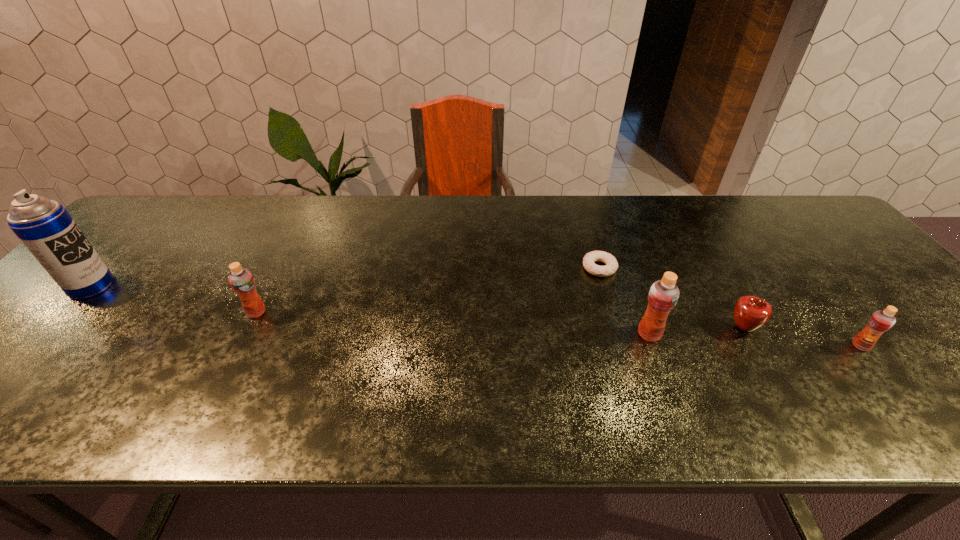
What are the coordinates of `vacant space at the right edge of the desktop` in the screenshot? It's located at (934, 350).

In the image, there is a desktop. At what (x,y) coordinates should I click in order to perform the action: click on vacant space at the far left corner. Please return your answer as a coordinate pair (x, y). Looking at the image, I should click on (182, 220).

The width and height of the screenshot is (960, 540). What are the coordinates of `vacant space at the far right corner` in the screenshot? It's located at (818, 235).

Find the location of a particular element. free area in between the tallest orange juice and the doughnut is located at coordinates (624, 301).

Where is `vacant area that lies between the leftmost object and the doughnut`? vacant area that lies between the leftmost object and the doughnut is located at coordinates (346, 277).

Image resolution: width=960 pixels, height=540 pixels. I want to click on free space between the second object from right to left and the rightmost orange juice, so click(802, 337).

Where is `empty space that is in between the fourth tallest object and the second shortest orange juice`? empty space that is in between the fourth tallest object and the second shortest orange juice is located at coordinates (559, 329).

Identify the location of free spot between the fifth object from right to left and the second tallest object. This screenshot has height=540, width=960. (453, 323).

Image resolution: width=960 pixels, height=540 pixels. I want to click on unoccupied area between the second shortest orange juice and the shortest orange juice, so click(x=559, y=329).

Locate an element on the screen. This screenshot has width=960, height=540. blank region between the third tallest object and the shortest object is located at coordinates click(428, 290).